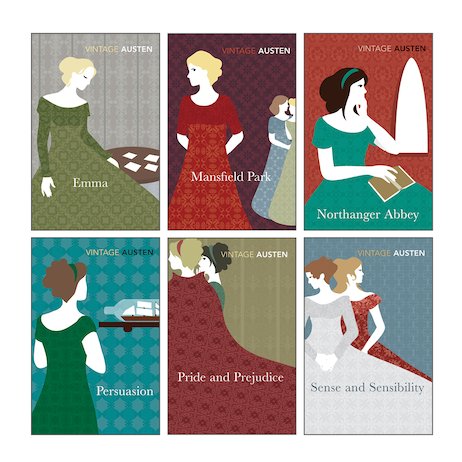
You are a GUI agent. You are given a task and a screenshot of the screen. Output one action in this format:
    pyautogui.click(x=<x>, y=<y>)
    Task: Click on the panel
    Image resolution: width=462 pixels, height=462 pixels.
    Given the screenshot: What is the action you would take?
    pyautogui.click(x=402, y=295), pyautogui.click(x=247, y=314), pyautogui.click(x=117, y=283), pyautogui.click(x=127, y=87), pyautogui.click(x=247, y=91), pyautogui.click(x=383, y=109)